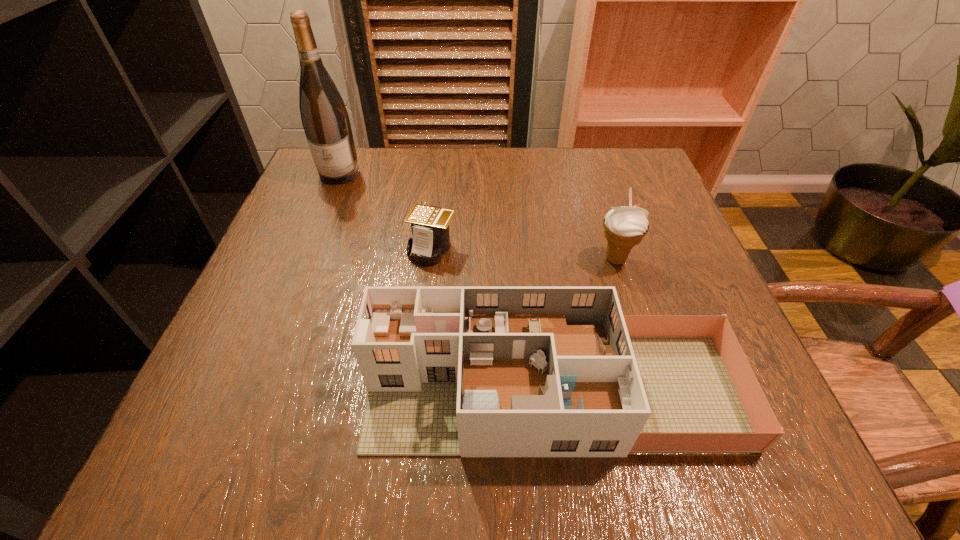
The image size is (960, 540). Find the location of `vacant region located 0.250m at the entrance of the dollhouse`. vacant region located 0.250m at the entrance of the dollhouse is located at coordinates (206, 391).

Locate an element on the screen. This screenshot has width=960, height=540. blank space located on the front of the shortest object is located at coordinates (426, 301).

The width and height of the screenshot is (960, 540). I want to click on object situated at the far edge, so (x=325, y=119).

Locate an element on the screen. Image resolution: width=960 pixels, height=540 pixels. object that is positioned at the near edge is located at coordinates (451, 371).

Where is `object present at the left edge`? object present at the left edge is located at coordinates point(325,119).

I want to click on icecream located at the right edge, so click(624, 227).

This screenshot has height=540, width=960. What are the coordinates of `dollhouse that is at the right edge` in the screenshot? It's located at [x=451, y=371].

Identify the location of object situated at the far left corner. The image size is (960, 540). (325, 119).

Find the location of a particular element. This screenshot has width=960, height=540. object present at the near right corner is located at coordinates (451, 371).

In the image, there is a desktop. At what (x,y) coordinates should I click in order to perform the action: click on vacant space at the far edge. Please return your answer as a coordinate pair (x, y). Image resolution: width=960 pixels, height=540 pixels. Looking at the image, I should click on (474, 156).